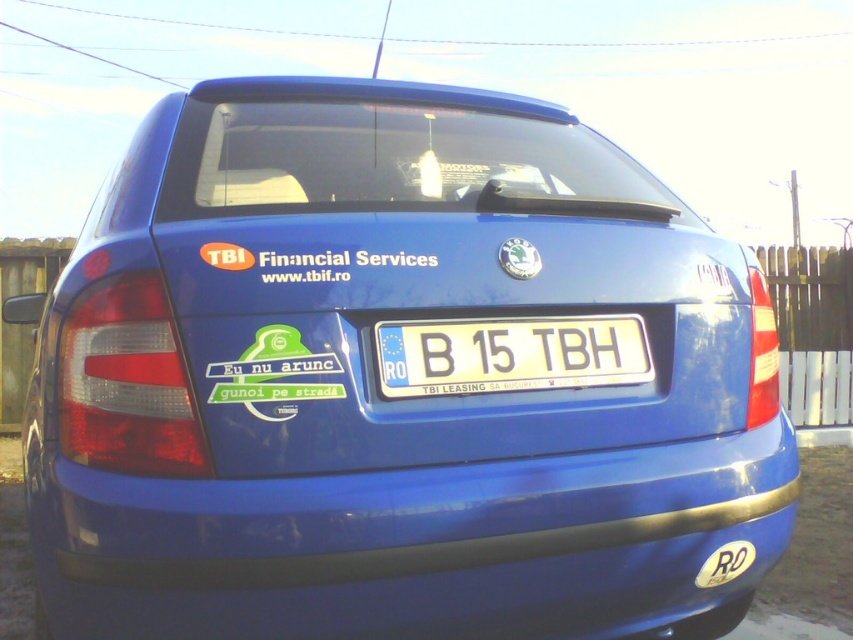
Question: Is glossy plastic bumper at lower center bigger than white plastic license plate at center?

Choices:
 (A) yes
 (B) no

Answer: (A)

Question: Which object appears closest to the camera in this image?

Choices:
 (A) white plastic license plate at center
 (B) glossy plastic bumper at lower center

Answer: (B)

Question: Where is glossy plastic bumper at lower center located in relation to white plastic license plate at center in the image?

Choices:
 (A) right
 (B) left

Answer: (B)

Question: Can you confirm if glossy plastic bumper at lower center is positioned below white plastic license plate at center?

Choices:
 (A) yes
 (B) no

Answer: (A)